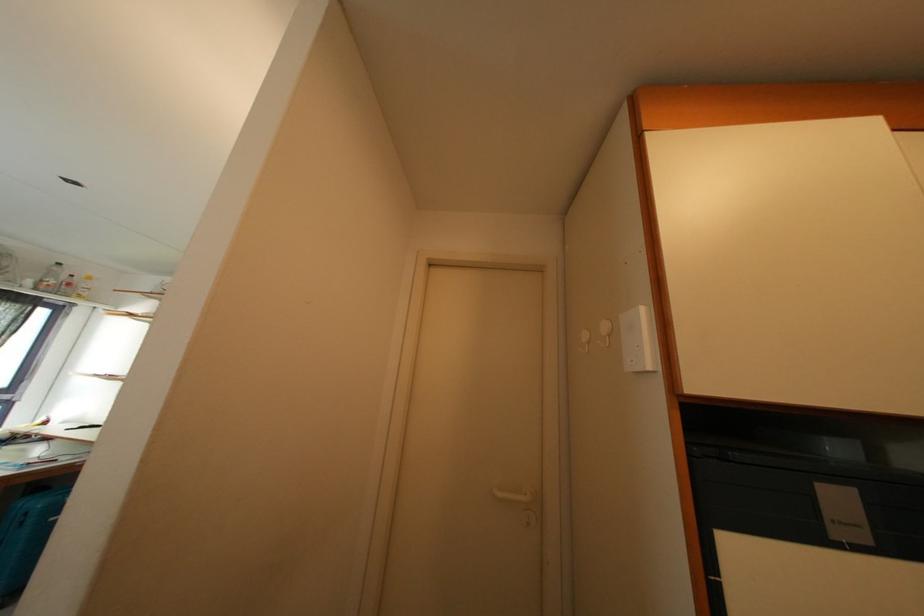
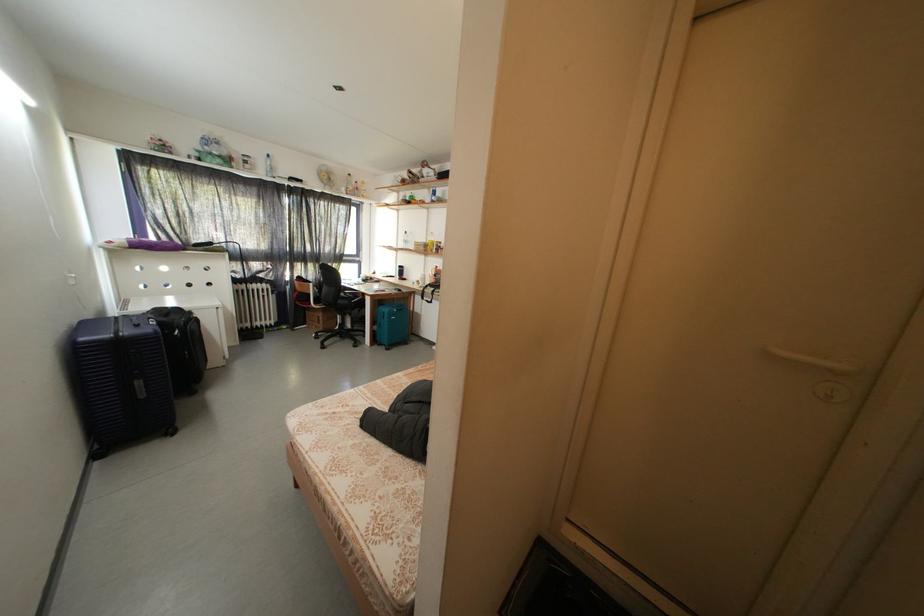
The images are taken continuously from a first-person perspective. In which direction is your viewpoint rotating?

The rotation direction of the camera is left-down.